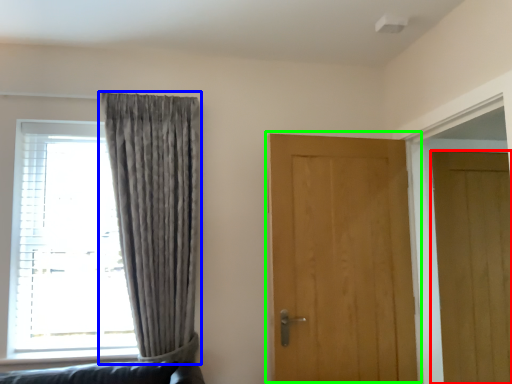
Question: Based on their relative distances, which object is farther from door (highlighted by a red box)? Choose from curtain (highlighted by a blue box) and door (highlighted by a green box).

Choices:
 (A) curtain
 (B) door

Answer: (A)